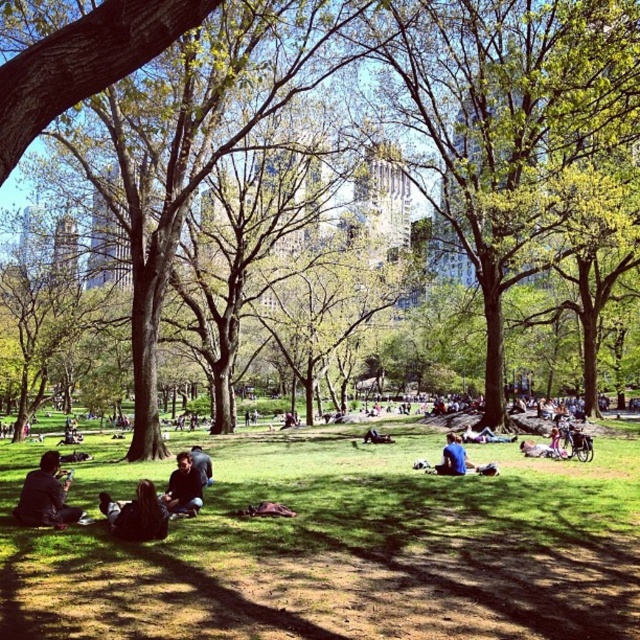
You are standing in the park and want to take a photo of the green grass at center and the dark brown hair at lower left. Which object should you focus on first to ensure both are in focus?

You should focus on the green grass at center first because it is closer to the viewer than the dark brown hair at lower left, so adjusting focus from near to far will help both be in focus.

Based on the photo, you are a photographer standing in the park and want to take a photo of the dark blue shirt at center without the green grass at center blocking the view. Is it possible to do so?

The green grass at center is much taller than the dark blue shirt at center, so it will block the view of the dark blue shirt at center. You need to move closer or find a higher angle to avoid the grass.

You are a photographer trying to capture a candid shot of the dark blue jeans at lower left and dark blue jeans at center. Since you want to focus on the lower left pair, which one should you adjust your camera focus to prioritize? Explain your reasoning based on their positions.

The dark blue jeans at lower left are shorter than the dark blue jeans at center. Therefore, to prioritize focusing on the lower left pair, you should adjust your camera focus to account for their shorter height so they appear clearer in the photo.